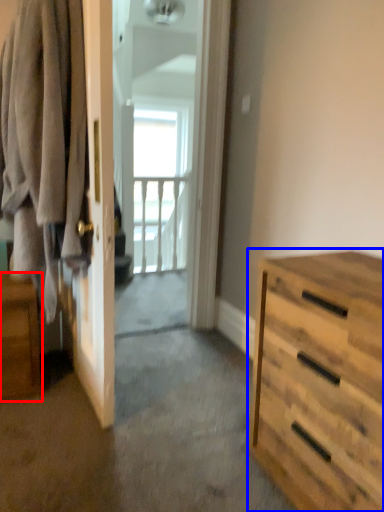
Question: Which of the following is the closest to the observer, nightstand (highlighted by a red box) or chest of drawers (highlighted by a blue box)?

Choices:
 (A) nightstand
 (B) chest of drawers

Answer: (B)